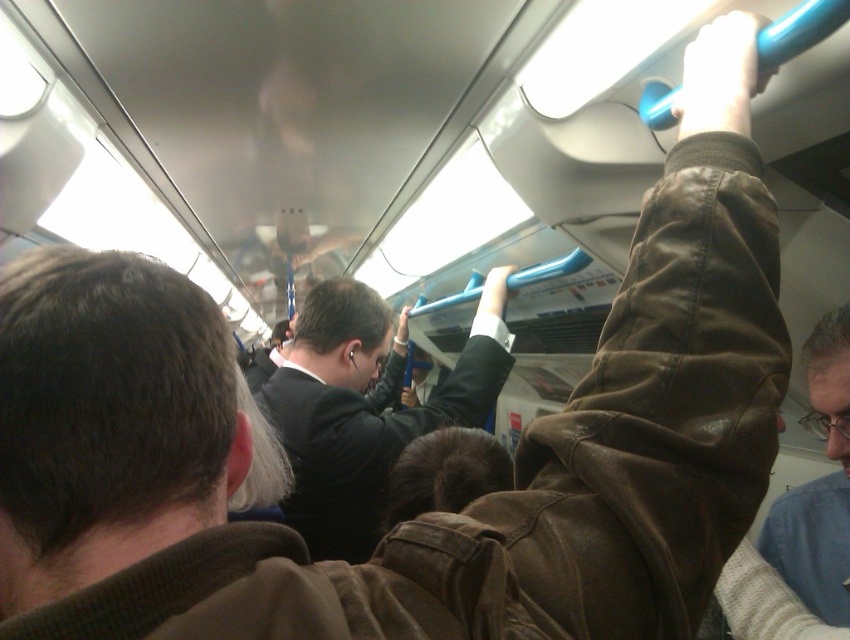
Question: Among these objects, which one is nearest to the camera?

Choices:
 (A) light brown leather jacket at upper right
 (B) black suit at center

Answer: (A)

Question: Can you confirm if black suit at center is positioned below light brown leather jacket at upper right?

Choices:
 (A) no
 (B) yes

Answer: (A)

Question: Where is black suit at center located in relation to light brown leather jacket at upper right in the image?

Choices:
 (A) above
 (B) below

Answer: (A)

Question: Does black suit at center have a lesser width compared to light brown leather jacket at upper right?

Choices:
 (A) yes
 (B) no

Answer: (B)

Question: Which point is farther from the camera taking this photo?

Choices:
 (A) (x=273, y=412)
 (B) (x=824, y=493)

Answer: (A)